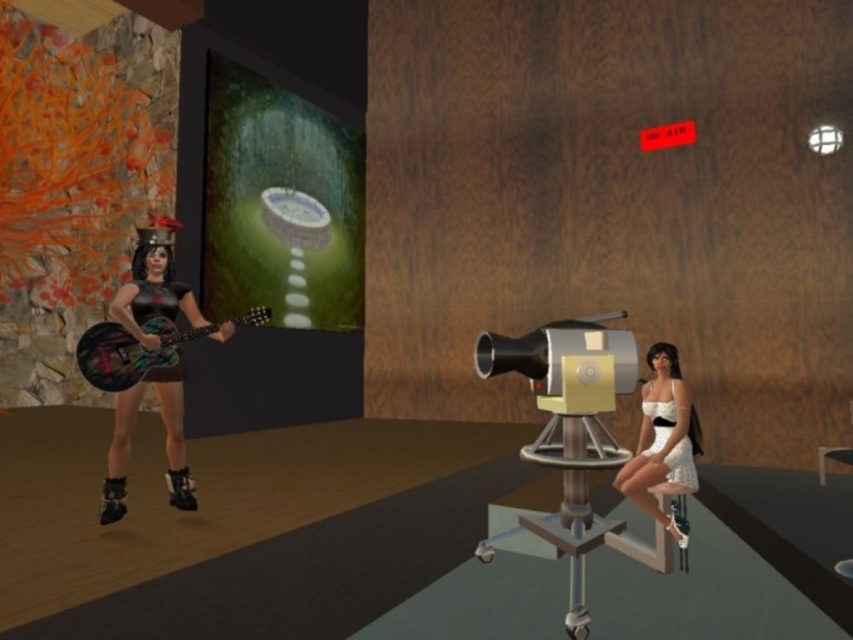
You are a photographer in the scene and need to adjust the distance between the white satin dress at center and the wooden stool at lower right to 40 inches for a better composition. What should you do?

Move the wooden stool at lower right 4.01 inches away from the white satin dress at center to achieve the desired distance of 40 inches between them.

You are a photographer preparing for a photoshoot. You have two dresses available for the shoot. The white satin dress at lower right and the shiny black dress at left. Which dress should you choose if you want to emphasize the model wearing it from a distance?

The white satin dress at lower right has a larger size compared to the shiny black dress at left, so it would be more visible and thus better for emphasizing the model from a distance.

You are a photographer setting up for a photoshoot in the room. You need to place a small decorative vase between the white satin dress at center and the wooden stool at lower right. Considering their sizes, which object should the vase be closer to?

The white satin dress at center is larger in size than the wooden stool at lower right, so the vase should be placed closer to the wooden stool at lower right to maintain balance between the two objects.